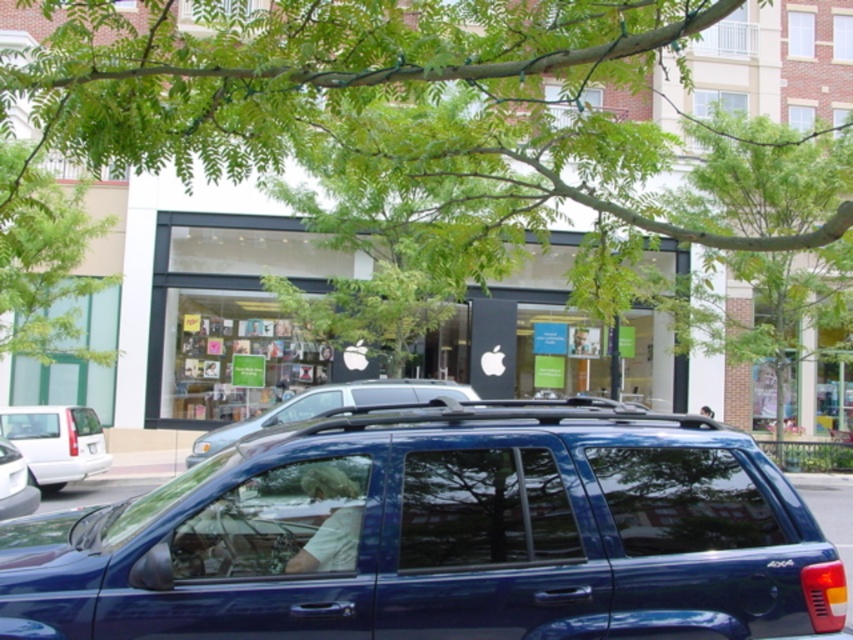
Is white matte van at left smaller than white plastic license plate at center?

No.

Can you confirm if white matte van at left is positioned to the right of white plastic license plate at center?

Incorrect, white matte van at left is not on the right side of white plastic license plate at center.

The height and width of the screenshot is (640, 853). Identify the location of white matte van at left. (54, 442).

Can you confirm if metallic blue suv at center is shorter than white plastic license plate at center?

Yes, metallic blue suv at center is shorter than white plastic license plate at center.

Does metallic blue suv at center appear under white plastic license plate at center?

Actually, metallic blue suv at center is above white plastic license plate at center.

Find the location of a particular element. metallic blue suv at center is located at coordinates (329, 406).

Is green leafy tree at upper center taller than white matte van at lower left?

Yes, green leafy tree at upper center is taller than white matte van at lower left.

Is point (418, 106) more distant than point (15, 500)?

Yes, it is behind point (15, 500).

Which is in front, point (612, 276) or point (21, 484)?

Point (612, 276) is in front.

What are the coordinates of `green leafy tree at upper center` in the screenshot? It's located at (395, 113).